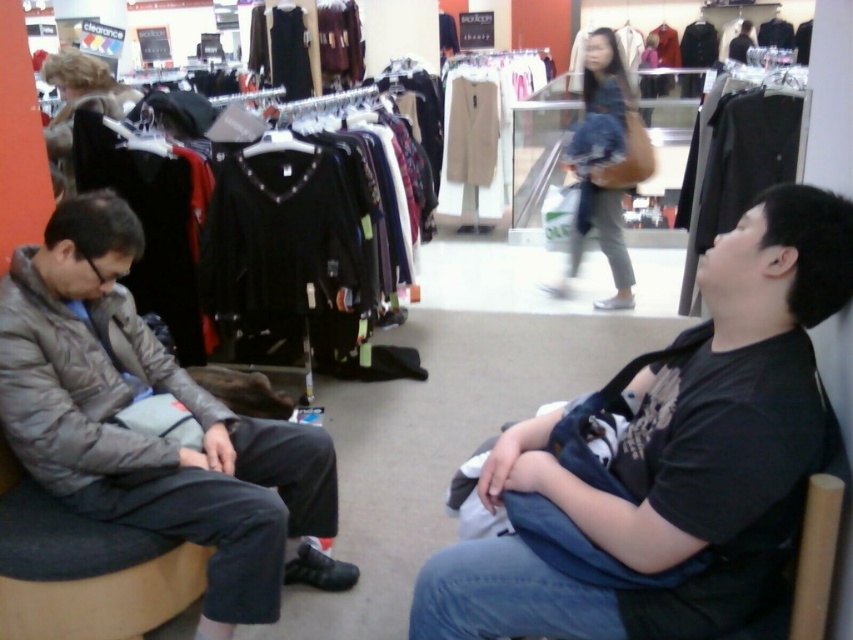
Question: Which object is farther from the camera taking this photo?

Choices:
 (A) gray quilted jacket at left
 (B) black cotton shirt at right

Answer: (A)

Question: Which object appears closest to the camera in this image?

Choices:
 (A) gray quilted jacket at left
 (B) black cotton shirt at right

Answer: (B)

Question: Can you confirm if black cotton shirt at right is bigger than gray quilted jacket at left?

Choices:
 (A) yes
 (B) no

Answer: (B)

Question: Is black cotton shirt at right closer to camera compared to gray quilted jacket at left?

Choices:
 (A) yes
 (B) no

Answer: (A)

Question: Does black cotton shirt at right appear over gray quilted jacket at left?

Choices:
 (A) yes
 (B) no

Answer: (A)